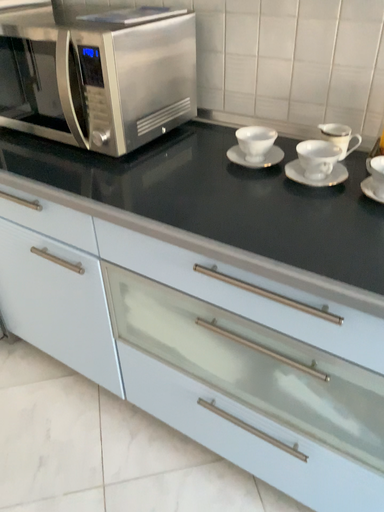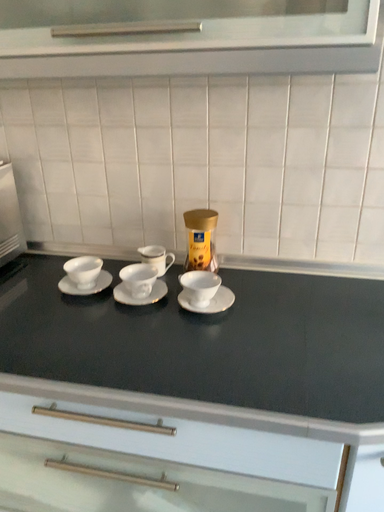
Question: How did the camera likely rotate when shooting the video?

Choices:
 (A) rotated downward
 (B) rotated upward

Answer: (B)